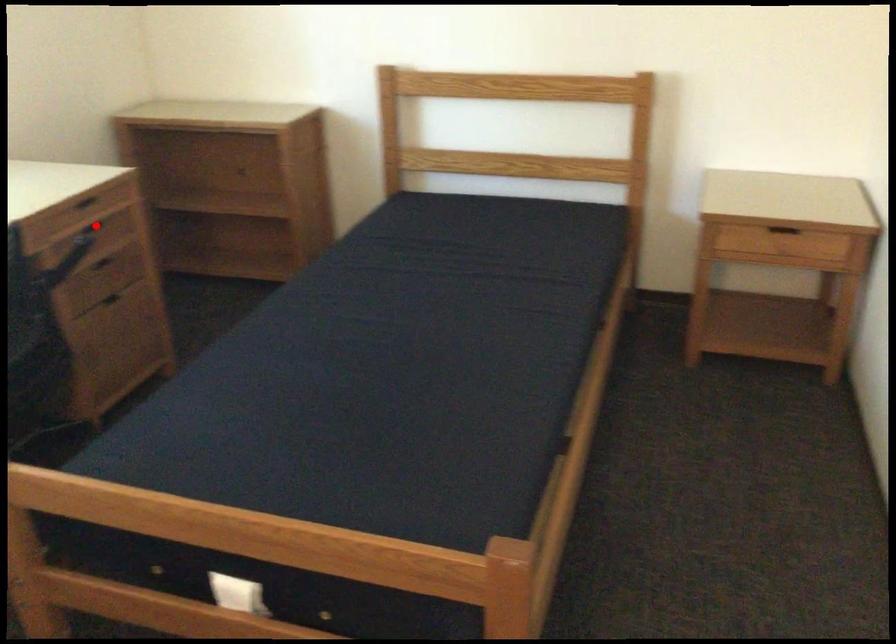
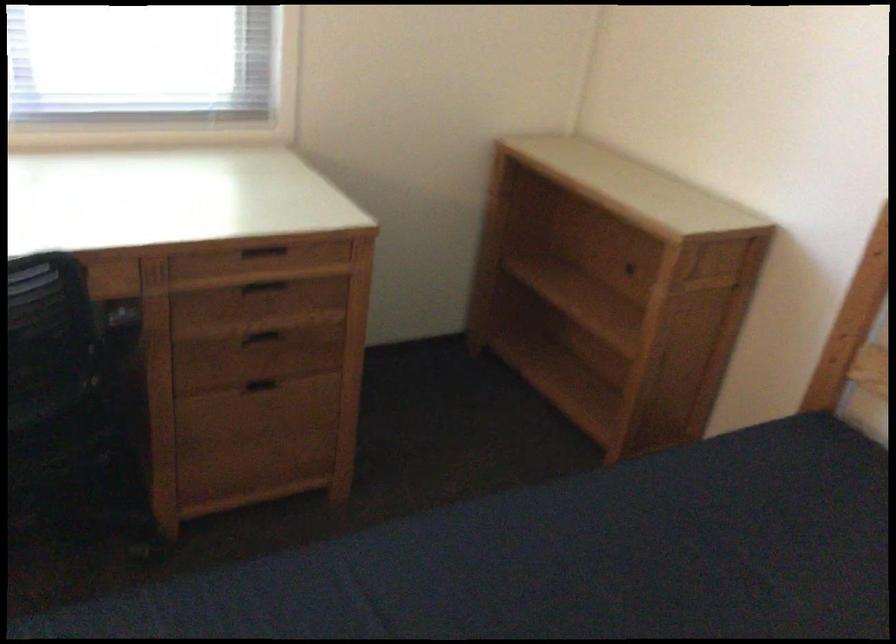
Question: I am providing you with two images of the same scene from different viewpoints. In image1, a red point is highlighted. Considering the same 3D point in image2, which of the following is correct?

Choices:
 (A) It is closer
 (B) It is farther

Answer: (A)